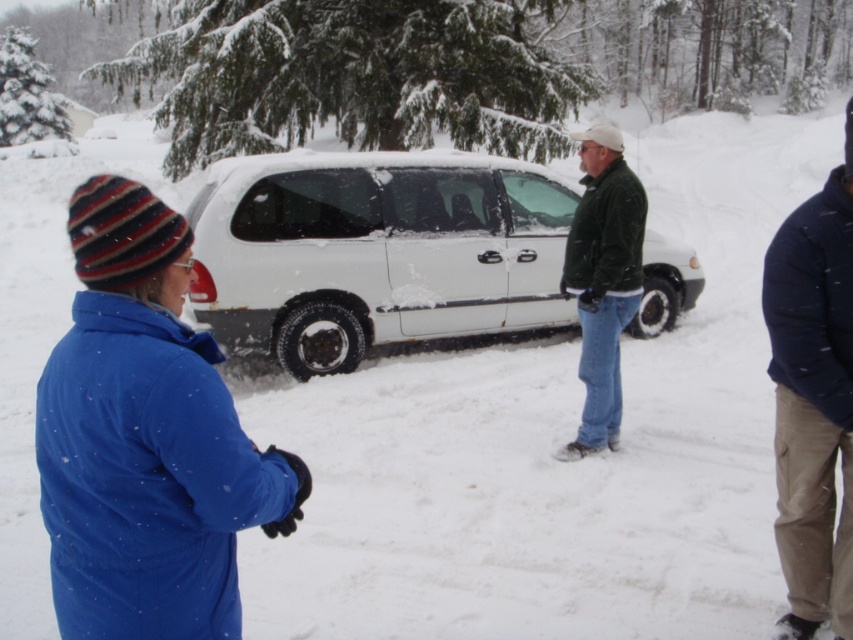
In the scene shown: You are a delivery driver who needs to load packages into the back of the white matte van at center. You are currently standing next to the dark blue fleece jacket at right. Can you directly access the van without moving around any objects or people?

The white matte van at center is further to the viewer than the dark blue fleece jacket at right, meaning the van is closer to you. Since you are standing next to the dark blue fleece jacket at right, you can directly access the white matte van at center without needing to move around any objects or people because it is in front of you.

You are trying to decide whether to park your car behind the white matte van at center. Your car is 1.8 meters wide. Can you fit your car in the space between the van and the green fuzzy jacket at center?

The white matte van at center is wider than the green fuzzy jacket at center. Since the van is wider, the space between them may be insufficient for your 1.8 meter wide car. You should check the actual width before deciding to park there.

You are standing at the point marked as point [375,252]. What object is located exactly at that point?

The white matte van at center is located exactly at point [375,252].